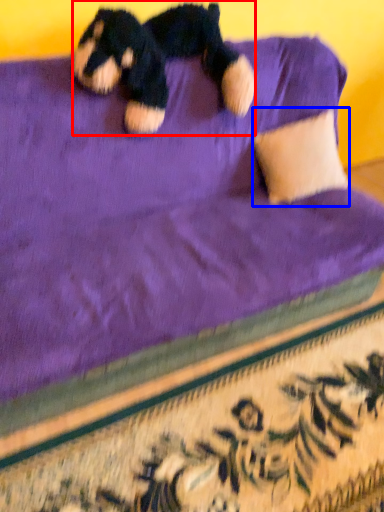
Question: Which object appears farthest to the camera in this image, teddy bear (highlighted by a red box) or pillow (highlighted by a blue box)?

Choices:
 (A) teddy bear
 (B) pillow

Answer: (B)